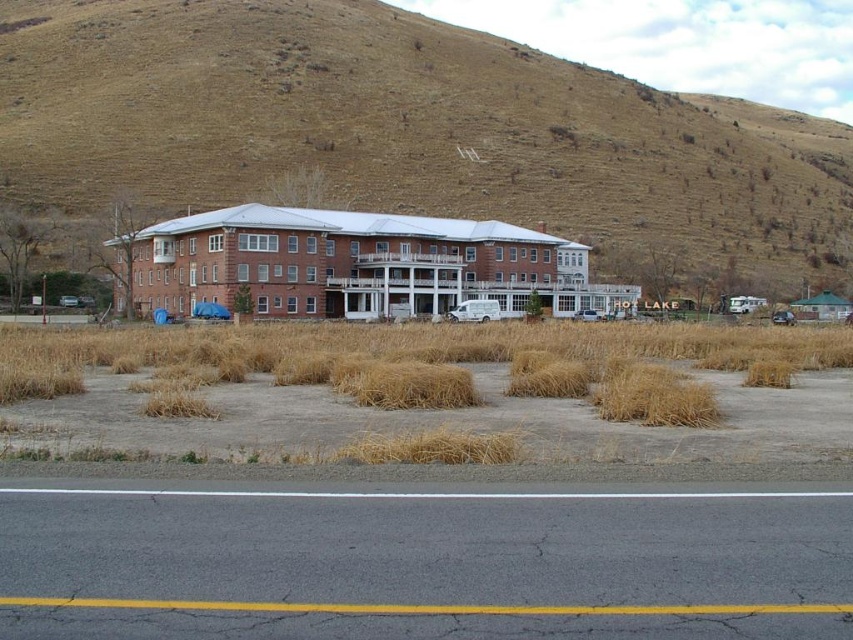
You are a landscape architect planning to install a new irrigation system. You need to decide where to place the sprinkler heads. Considering the brown grassy hillside at upper center and the dry straw at lower center, which area requires more water based on their sizes?

The brown grassy hillside at upper center requires more water because it has a larger size compared to the dry straw at lower center, so it needs more water to cover its area.

You are standing in front of the building and see two points marked on the ground. Which point is closer to you, the point at coordinates point (521, 58) or point (569, 323)?

The point at coordinates point (521, 58) is closer to you because it is further to the viewer than point (569, 323).